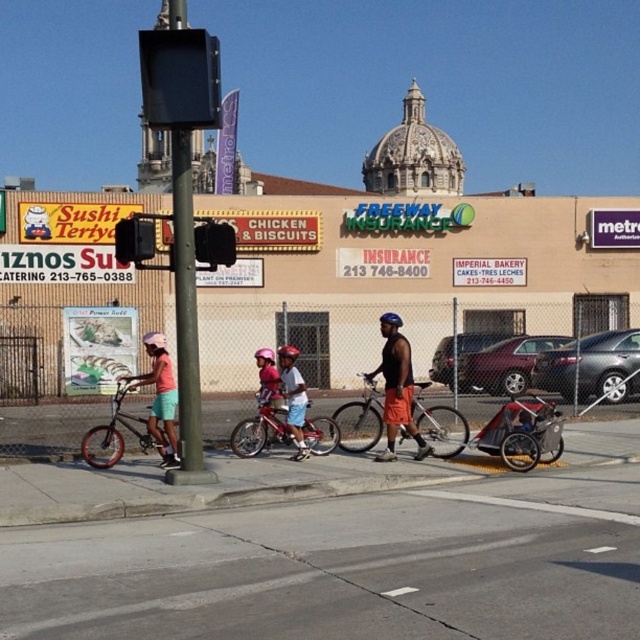
Question: Does pink fabric shorts at lower left come in front of pink fabric helmet at center?

Choices:
 (A) no
 (B) yes

Answer: (B)

Question: Considering the real-world distances, which object is farthest from the shiny red bicycle at center?

Choices:
 (A) silver metallic bicycle at center
 (B) light blue denim shorts at center

Answer: (A)

Question: Among these points, which one is farthest from the camera?

Choices:
 (A) (200, 257)
 (B) (288, 384)
 (C) (141, 378)

Answer: (B)

Question: Does gray metallic sedan at center come behind shiny red bicycle at center?

Choices:
 (A) yes
 (B) no

Answer: (A)

Question: Does green matte pole at center have a smaller size compared to metallic traffic light at center?

Choices:
 (A) no
 (B) yes

Answer: (A)

Question: Which of these objects is positioned farthest from the shiny red bicycle at center?

Choices:
 (A) silver metallic bicycle at left
 (B) gray metallic sedan at center
 (C) pink fabric helmet at center

Answer: (B)